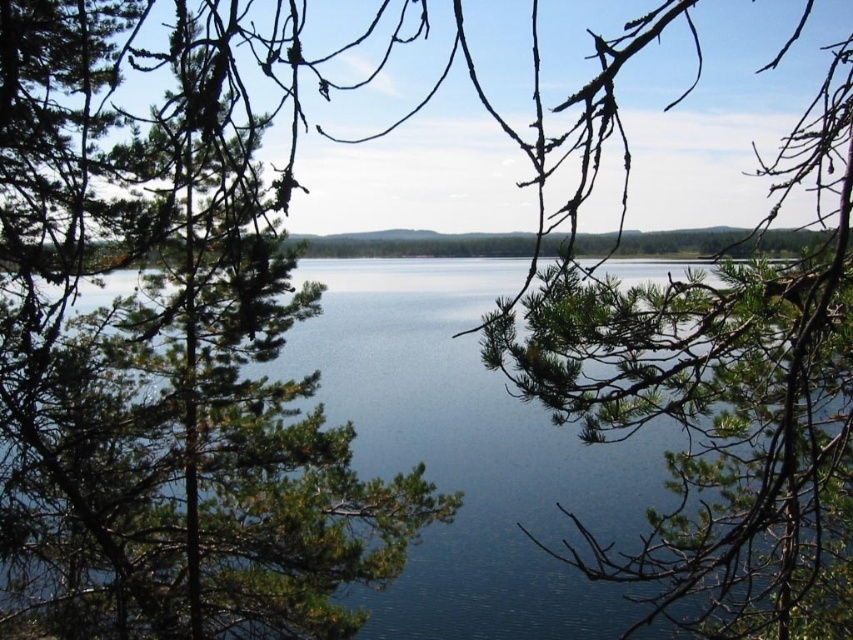
Question: Which object is farther from the camera taking this photo?

Choices:
 (A) green needle-like branches at center
 (B) blue water at center

Answer: (B)

Question: Can you confirm if green needle-like branches at center is thinner than blue water at center?

Choices:
 (A) no
 (B) yes

Answer: (B)

Question: Does green needle-like branches at center have a lesser width compared to blue water at center?

Choices:
 (A) no
 (B) yes

Answer: (B)

Question: Can you confirm if green needle-like branches at center is positioned to the left of blue water at center?

Choices:
 (A) no
 (B) yes

Answer: (B)

Question: Which point appears closest to the camera in this image?

Choices:
 (A) (422, 371)
 (B) (35, 433)

Answer: (B)